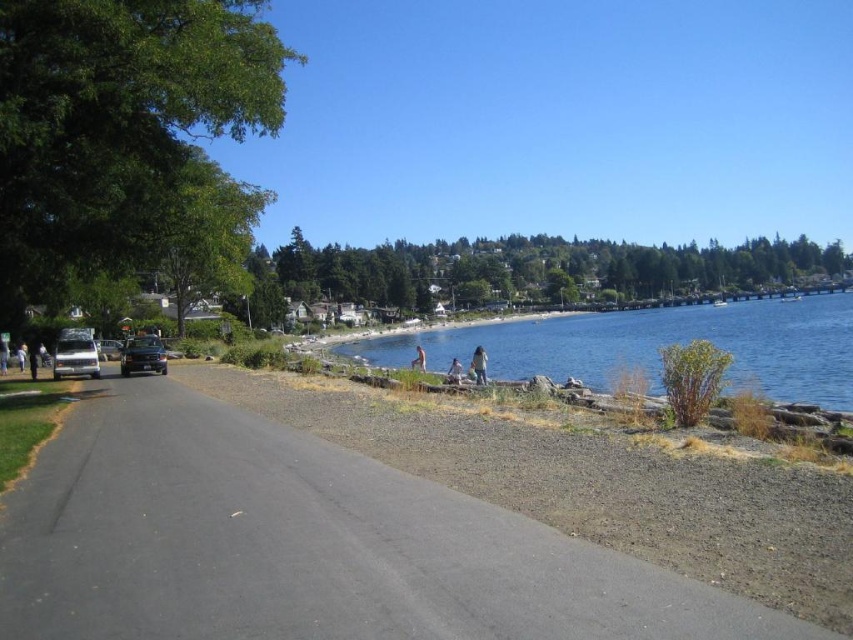
Does light brown fabric pants at center have a greater width compared to skinny nude person at center?

In fact, light brown fabric pants at center might be narrower than skinny nude person at center.

Between light brown fabric pants at center and skinny nude person at center, which one is positioned higher?

light brown fabric pants at center is above.

The height and width of the screenshot is (640, 853). I want to click on light brown fabric pants at center, so click(454, 371).

Locate an element on the screen. light brown fabric pants at center is located at coordinates (454, 371).

Between metallic silver car at left and matte black person at left, which one has more height?

With more height is metallic silver car at left.

Does metallic silver car at left have a greater height compared to matte black person at left?

Yes, metallic silver car at left is taller than matte black person at left.

What do you see at coordinates (74, 356) in the screenshot?
I see `metallic silver car at left` at bounding box center [74, 356].

This screenshot has height=640, width=853. Identify the location of metallic silver car at left. (74, 356).

Is blue water at center shorter than satin black car at left?

Incorrect, blue water at center's height does not fall short of satin black car at left's.

Between point (786, 342) and point (164, 362), which one is positioned behind?

The point (786, 342) is behind.

The image size is (853, 640). Identify the location of blue water at center. (654, 346).